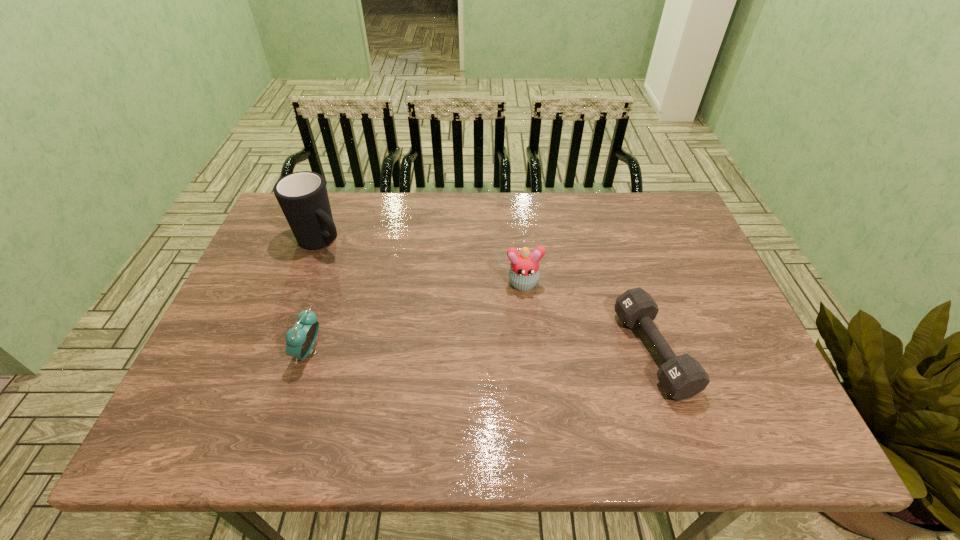
Where is `object that is positioned at the far left corner`? The image size is (960, 540). object that is positioned at the far left corner is located at coordinates (302, 196).

The image size is (960, 540). I want to click on object present at the near right corner, so click(682, 377).

The width and height of the screenshot is (960, 540). I want to click on free space at the far edge of the desktop, so click(462, 192).

The width and height of the screenshot is (960, 540). What are the coordinates of `vacant space at the near edge of the desktop` in the screenshot? It's located at (540, 389).

What are the coordinates of `blank space at the left edge of the desktop` in the screenshot? It's located at (272, 250).

Find the location of a particular element. free region at the right edge of the desktop is located at coordinates (703, 279).

The width and height of the screenshot is (960, 540). What are the coordinates of `vacant space at the far right corner of the desktop` in the screenshot? It's located at (650, 225).

Where is `blank region between the alarm clock and the tallest object`? The width and height of the screenshot is (960, 540). blank region between the alarm clock and the tallest object is located at coordinates (316, 297).

Where is `unoccupied area between the second object from right to left and the tallest object`? Image resolution: width=960 pixels, height=540 pixels. unoccupied area between the second object from right to left and the tallest object is located at coordinates (422, 262).

Where is `empty location between the rightmost object and the alarm clock`? This screenshot has width=960, height=540. empty location between the rightmost object and the alarm clock is located at coordinates [482, 352].